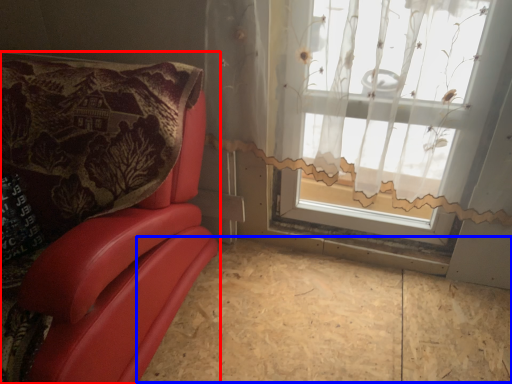
Question: Which of the following is the farthest to the observer, furniture (highlighted by a red box) or plywood (highlighted by a blue box)?

Choices:
 (A) furniture
 (B) plywood

Answer: (B)